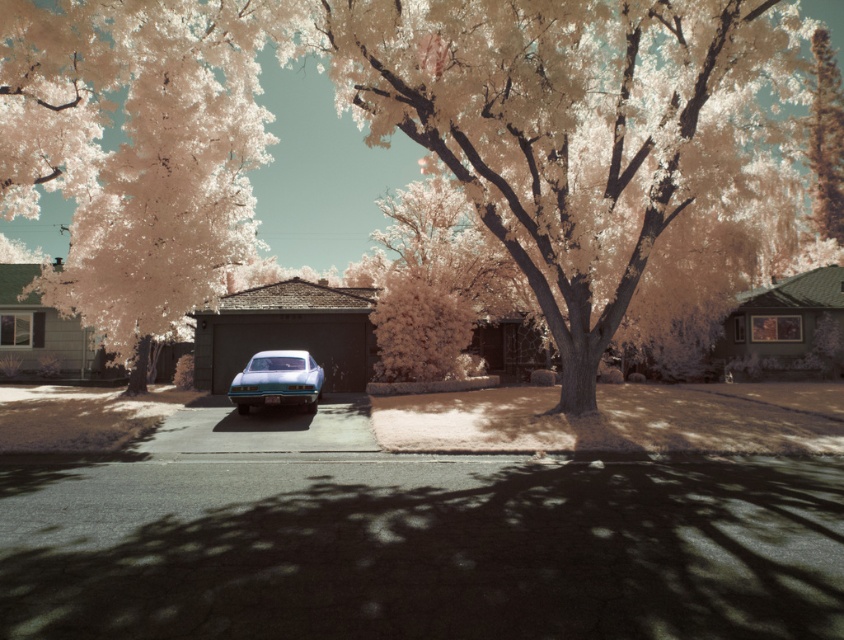
Question: Which of the following is the farthest from the observer?

Choices:
 (A) translucent pink foliage at left
 (B) matte blue car at center
 (C) dark brown wooden garage at right

Answer: (C)

Question: Which object is farther from the camera taking this photo?

Choices:
 (A) dark brown wooden garage at right
 (B) asphalt at center

Answer: (A)

Question: Which point is farther to the camera?

Choices:
 (A) smooth bark tree at upper right
 (B) dark brown wooden garage at right
 (C) translucent pink foliage at left
 (D) matte gray garage at left

Answer: (B)

Question: Where is dark brown wooden garage at right located in relation to matte gray garage at left in the image?

Choices:
 (A) below
 (B) above

Answer: (A)

Question: Observing the image, what is the correct spatial positioning of sepia textured tree at center in reference to matte blue car at center?

Choices:
 (A) below
 (B) above

Answer: (B)

Question: Is asphalt at center positioned behind matte gray garage at left?

Choices:
 (A) no
 (B) yes

Answer: (A)